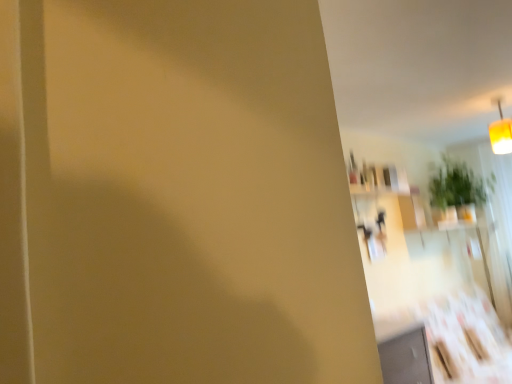
Question: Is the position of green leafy plant at upper right less distant than that of yellow fabric lampshade at upper right?

Choices:
 (A) no
 (B) yes

Answer: (A)

Question: Is green leafy plant at upper right oriented away from yellow fabric lampshade at upper right?

Choices:
 (A) no
 (B) yes

Answer: (A)

Question: Can you confirm if green leafy plant at upper right is bigger than yellow fabric lampshade at upper right?

Choices:
 (A) yes
 (B) no

Answer: (A)

Question: Considering the relative positions of green leafy plant at upper right and yellow fabric lampshade at upper right in the image provided, is green leafy plant at upper right to the left of yellow fabric lampshade at upper right from the viewer's perspective?

Choices:
 (A) yes
 (B) no

Answer: (B)

Question: From the image's perspective, is green leafy plant at upper right on yellow fabric lampshade at upper right?

Choices:
 (A) no
 (B) yes

Answer: (A)

Question: From the image's perspective, is green leafy plant at upper right located beneath yellow fabric lampshade at upper right?

Choices:
 (A) yes
 (B) no

Answer: (A)

Question: From the image's perspective, is yellow fabric lampshade at upper right on green leafy plant at upper right?

Choices:
 (A) no
 (B) yes

Answer: (B)

Question: From the image's perspective, is yellow fabric lampshade at upper right located beneath green leafy plant at upper right?

Choices:
 (A) yes
 (B) no

Answer: (B)

Question: Is yellow fabric lampshade at upper right to the left of green leafy plant at upper right from the viewer's perspective?

Choices:
 (A) no
 (B) yes

Answer: (B)

Question: Is yellow fabric lampshade at upper right to the right of green leafy plant at upper right from the viewer's perspective?

Choices:
 (A) yes
 (B) no

Answer: (B)

Question: Considering the relative sizes of yellow fabric lampshade at upper right and green leafy plant at upper right in the image provided, is yellow fabric lampshade at upper right thinner than green leafy plant at upper right?

Choices:
 (A) no
 (B) yes

Answer: (B)

Question: Could you tell me if yellow fabric lampshade at upper right is facing green leafy plant at upper right?

Choices:
 (A) no
 (B) yes

Answer: (A)

Question: Is yellow fabric lampshade at upper right in front of or behind green leafy plant at upper right in the image?

Choices:
 (A) front
 (B) behind

Answer: (A)